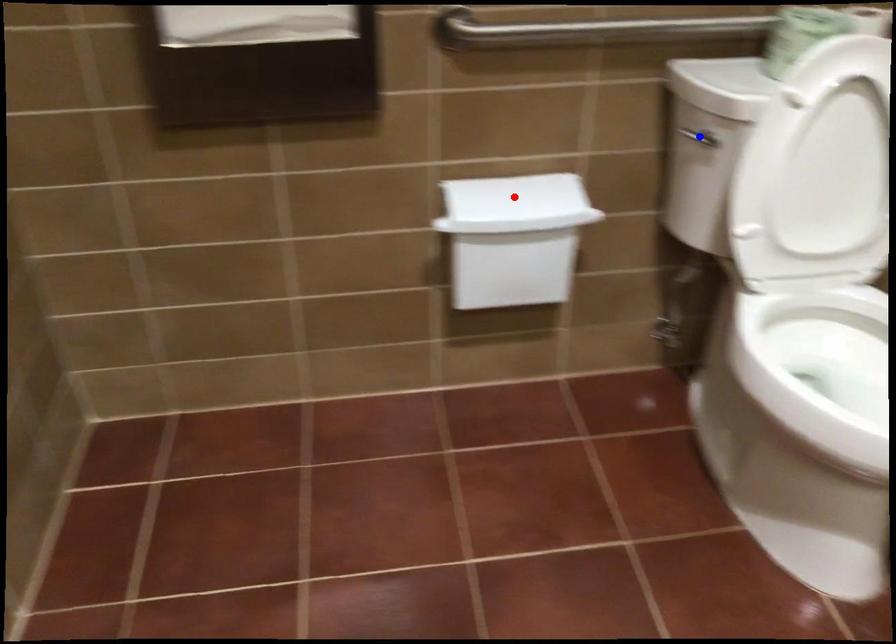
Question: Which of the two points in the image is closer to the camera?

Choices:
 (A) Blue point is closer.
 (B) Red point is closer.

Answer: (A)